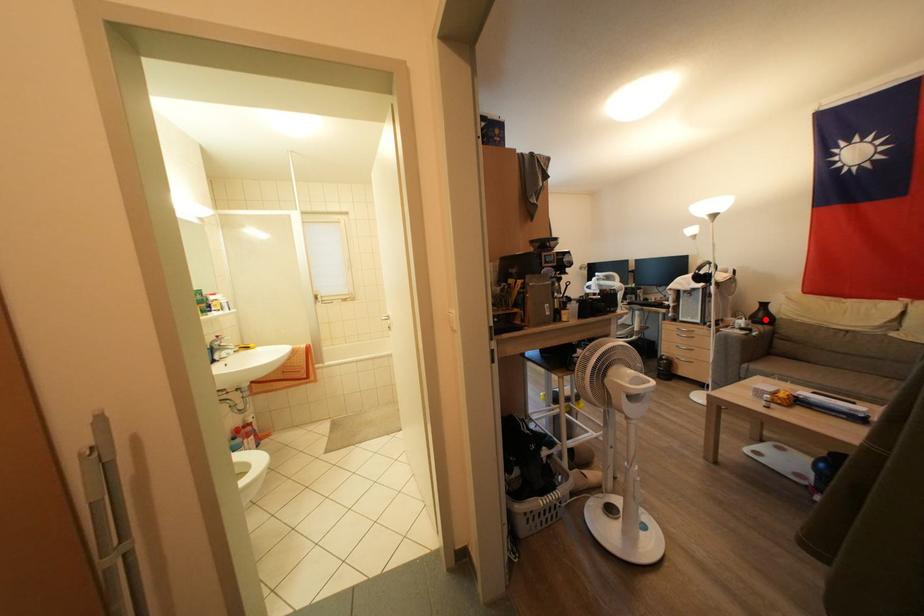
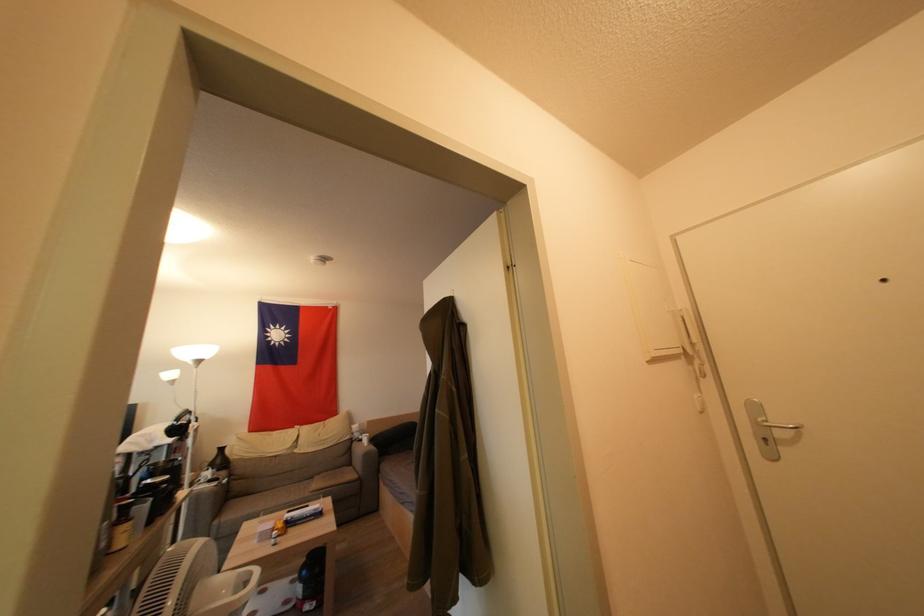
In the second image, find the point that corresponds to the highlighted location in the first image.

(224, 464)